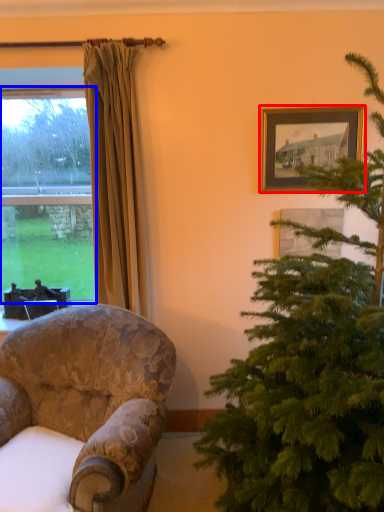
Question: Among these objects, which one is nearest to the camera, picture frame (highlighted by a red box) or window (highlighted by a blue box)?

Choices:
 (A) picture frame
 (B) window

Answer: (A)